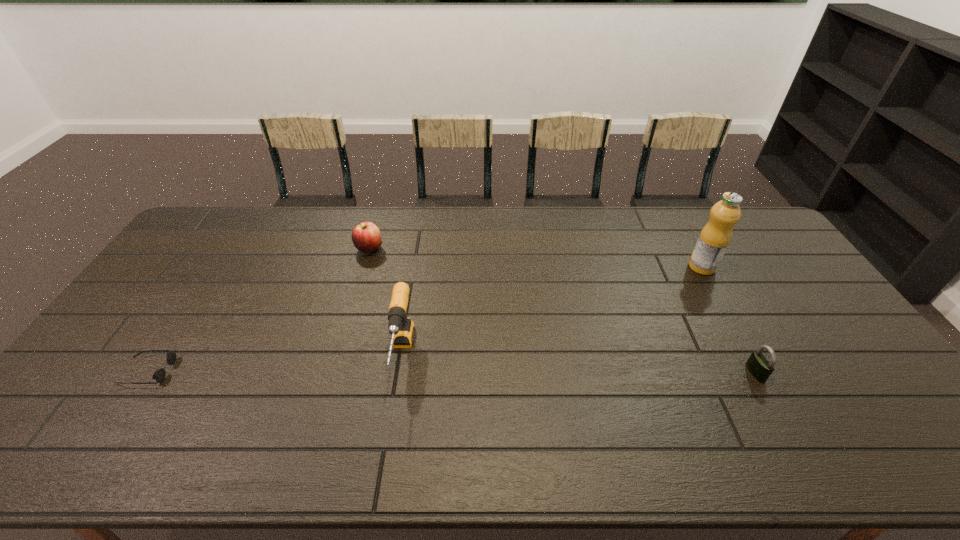
Find the location of a particular element. This screenshot has width=960, height=540. free space at the left edge of the desktop is located at coordinates [x=125, y=365].

In the image, there is a desktop. Where is `vacant space at the right edge`? Image resolution: width=960 pixels, height=540 pixels. vacant space at the right edge is located at coordinates (830, 313).

Identify the location of vacant point located between the sunglasses and the tallest object. (424, 319).

Where is `empty space that is in between the apple and the fourth shortest object`? Image resolution: width=960 pixels, height=540 pixels. empty space that is in between the apple and the fourth shortest object is located at coordinates (386, 301).

The image size is (960, 540). I want to click on vacant space that's between the padlock and the fourth shortest object, so click(x=578, y=363).

Locate an element on the screen. free space between the drill and the padlock is located at coordinates point(578,363).

The width and height of the screenshot is (960, 540). Identify the location of free space that is in between the shortest object and the fruit juice. (424, 319).

In order to click on blank region between the tallest object and the farthest object in this screenshot , I will do `click(536, 258)`.

Identify the location of free space between the padlock and the tallest object. (729, 320).

Find the location of `free space between the padlock and the fruit juice`. free space between the padlock and the fruit juice is located at coordinates (729, 320).